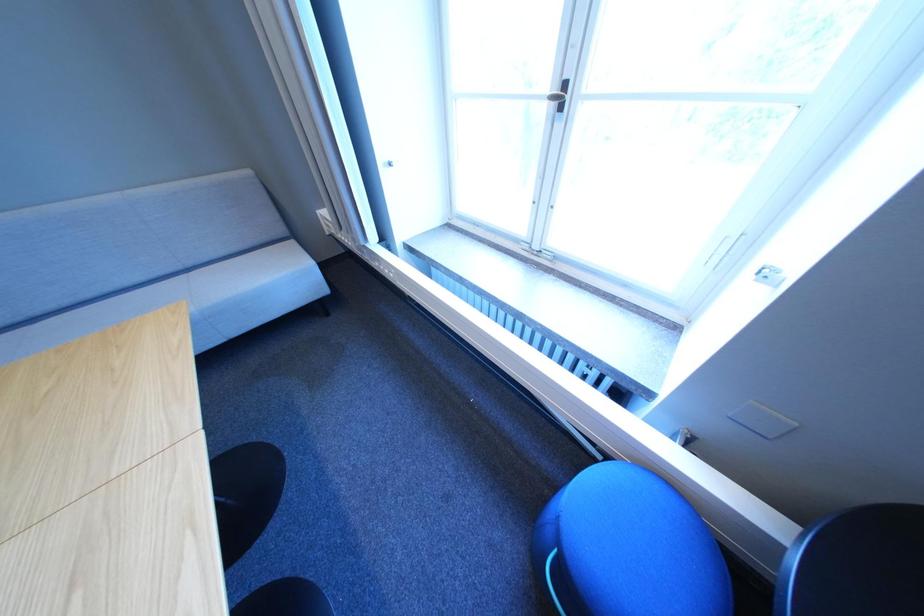
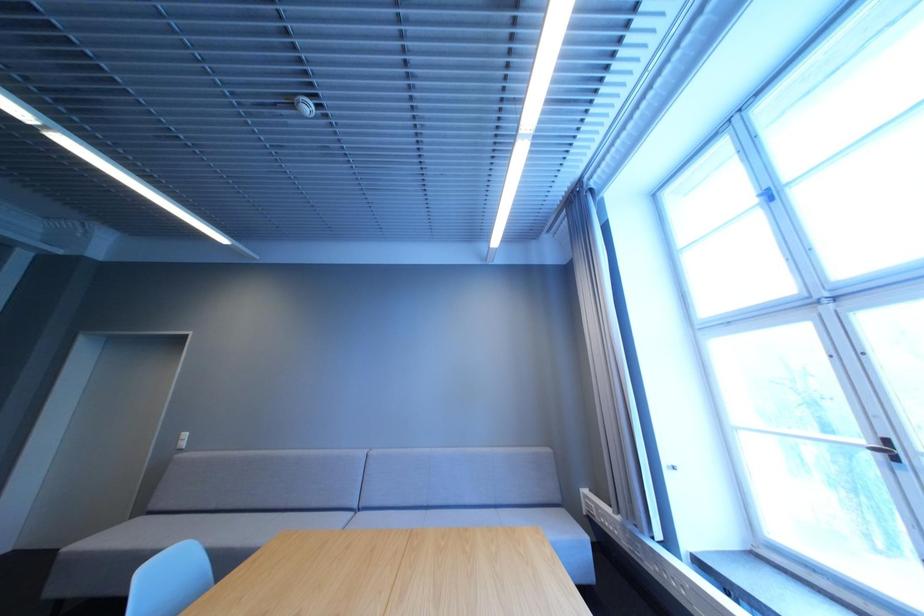
First-person continuous shooting, in which direction is the camera rotating?

The camera rotated toward left-up.